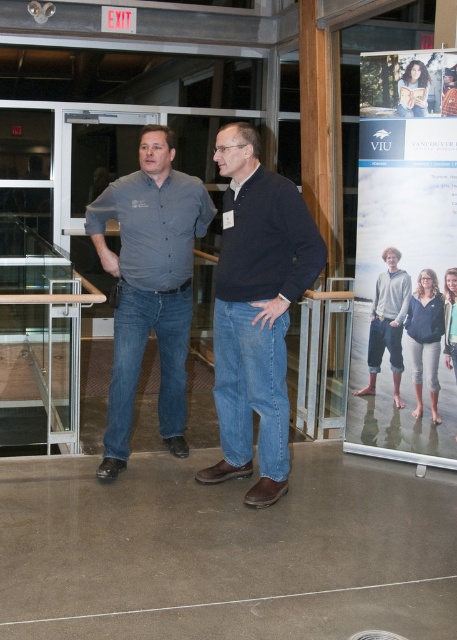
Is matte gray shirt at center further to camera compared to matte black hair at upper center?

No, it is in front of matte black hair at upper center.

What do you see at coordinates (149, 285) in the screenshot? The width and height of the screenshot is (457, 640). I see `matte gray shirt at center` at bounding box center [149, 285].

Locate an element on the screen. The image size is (457, 640). matte gray shirt at center is located at coordinates (149, 285).

Image resolution: width=457 pixels, height=640 pixels. What do you see at coordinates (256, 310) in the screenshot?
I see `dark blue sweater at center` at bounding box center [256, 310].

Identify the location of dark blue sweater at center. The image size is (457, 640). (256, 310).

Can you confirm if matte gray shirt at center is wider than gray cotton hoodie at center?

Yes, matte gray shirt at center is wider than gray cotton hoodie at center.

Between matte gray shirt at center and gray cotton hoodie at center, which one appears on the left side from the viewer's perspective?

matte gray shirt at center is more to the left.

The width and height of the screenshot is (457, 640). Identify the location of matte gray shirt at center. (149, 285).

Where is `matte gray shirt at center`? The image size is (457, 640). matte gray shirt at center is located at coordinates (149, 285).